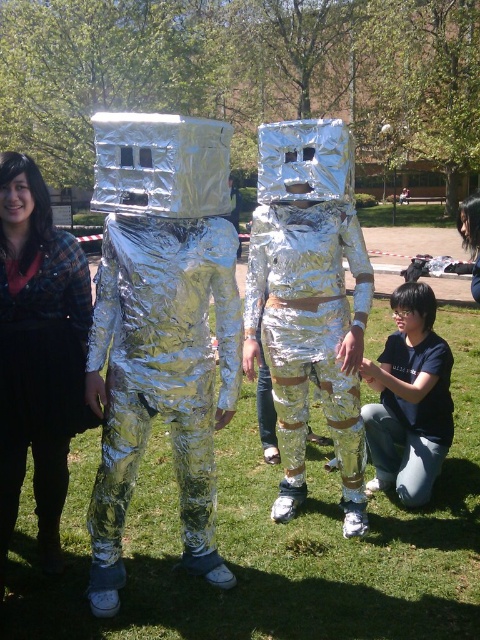
How much distance is there between green grass at center and black matte shirt at lower right?

green grass at center is 67.72 centimeters from black matte shirt at lower right.

Which is more to the left, green grass at center or black matte shirt at lower right?

green grass at center is more to the left.

Locate an element on the screen. green grass at center is located at coordinates (272, 545).

Can you confirm if green grass at center is smaller than shiny metallic astronaut at center?

No.

Is green grass at center below shiny metallic astronaut at center?

Yes.

Locate an element on the screen. green grass at center is located at coordinates (272, 545).

The width and height of the screenshot is (480, 640). In order to click on green grass at center in this screenshot , I will do `click(272, 545)`.

Can you confirm if shiny metallic suit at center is shorter than shiny metallic astronaut at center?

Indeed, shiny metallic suit at center has a lesser height compared to shiny metallic astronaut at center.

Image resolution: width=480 pixels, height=640 pixels. I want to click on shiny metallic suit at center, so click(x=160, y=326).

Does point (107, 160) come in front of point (289, 166)?

Yes, it is in front of point (289, 166).

Locate an element on the screen. shiny metallic suit at center is located at coordinates 160,326.